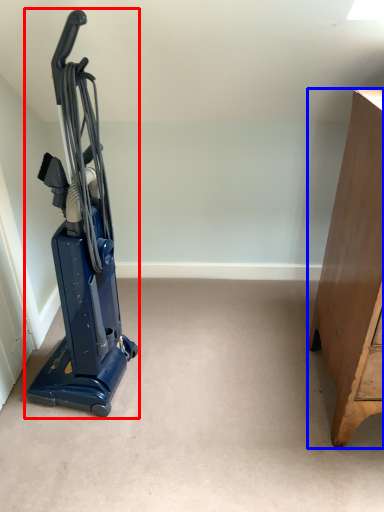
Question: Which of the following is the farthest to the observer, home appliance (highlighted by a red box) or furniture (highlighted by a blue box)?

Choices:
 (A) home appliance
 (B) furniture

Answer: (A)